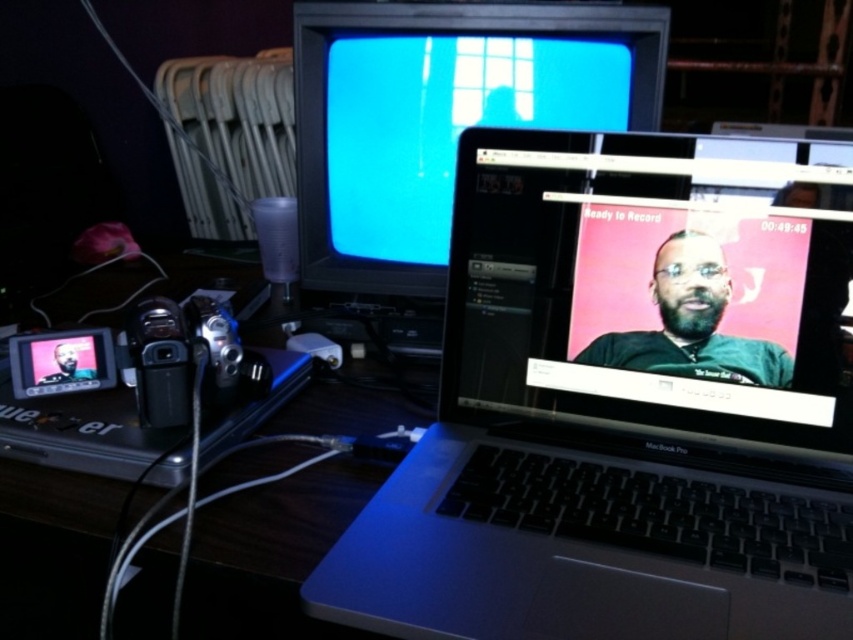
Question: Which point is closer to the camera?

Choices:
 (A) satin black camera at left
 (B) matte black laptop at center

Answer: (B)

Question: Can you confirm if satin black camera at left is bigger than silver plastic video camera at lower left?

Choices:
 (A) no
 (B) yes

Answer: (B)

Question: Does sleek silver laptop at center appear on the right side of satin black camera at left?

Choices:
 (A) yes
 (B) no

Answer: (A)

Question: Which of these objects is positioned closest to the sleek silver laptop at center?

Choices:
 (A) silver plastic video camera at lower left
 (B) satin black camera at left
 (C) matte black laptop at center
 (D) matte black monitor at upper center

Answer: (C)

Question: Which point is closer to the camera taking this photo?

Choices:
 (A) (210, 362)
 (B) (415, 148)
 (C) (444, 499)

Answer: (C)

Question: Can you confirm if satin black camera at left is positioned to the left of silver plastic video camera at lower left?

Choices:
 (A) no
 (B) yes

Answer: (A)